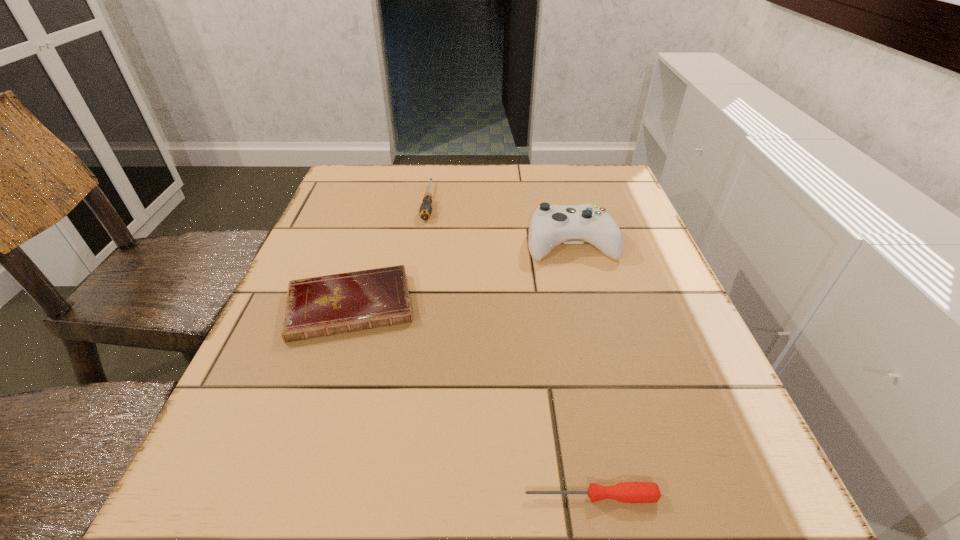
This screenshot has height=540, width=960. In order to click on control in this screenshot , I will do `click(550, 225)`.

In order to click on the tallest object in this screenshot , I will do `click(550, 225)`.

The height and width of the screenshot is (540, 960). In order to click on the taller screwdriver in this screenshot , I will do 425,210.

Image resolution: width=960 pixels, height=540 pixels. Find the location of `the farther screwdriver`. the farther screwdriver is located at coordinates (425, 210).

At what (x,y) coordinates should I click in order to perform the action: click on the second nearest object. Please return your answer as a coordinate pair (x, y). The image size is (960, 540). Looking at the image, I should click on click(x=321, y=306).

Identify the location of the right screwdriver. (626, 492).

At what (x,y) coordinates should I click in order to perform the action: click on the nearer screwdriver. Please return your answer as a coordinate pair (x, y). The image size is (960, 540). Looking at the image, I should click on click(x=626, y=492).

In order to click on vacant space situated 0.070m on the left of the third nearest object in this screenshot , I will do `click(494, 243)`.

Identify the location of free spot located 0.140m on the right of the farther screwdriver. (490, 202).

The height and width of the screenshot is (540, 960). Find the location of `vacant space located 0.100m on the right of the second nearest object`. vacant space located 0.100m on the right of the second nearest object is located at coordinates (468, 306).